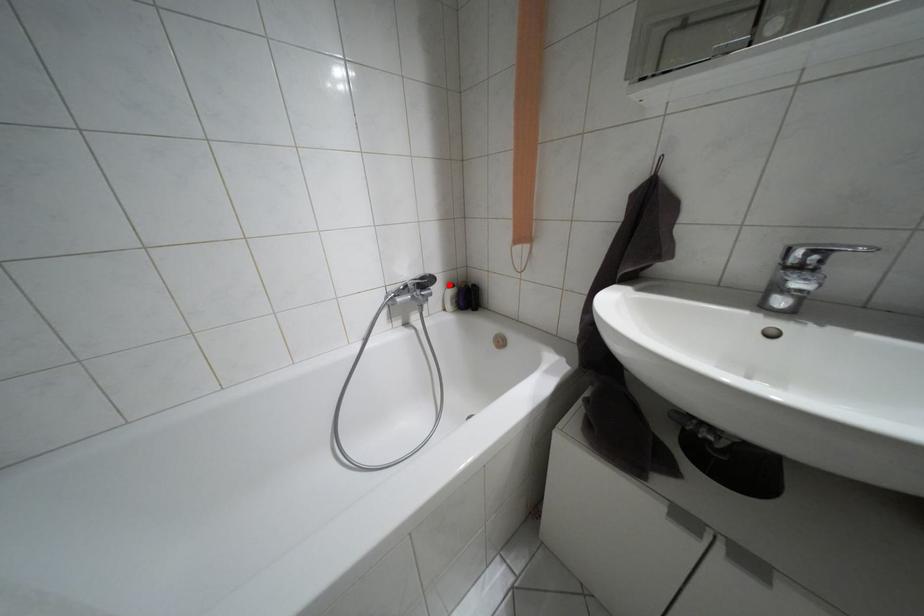
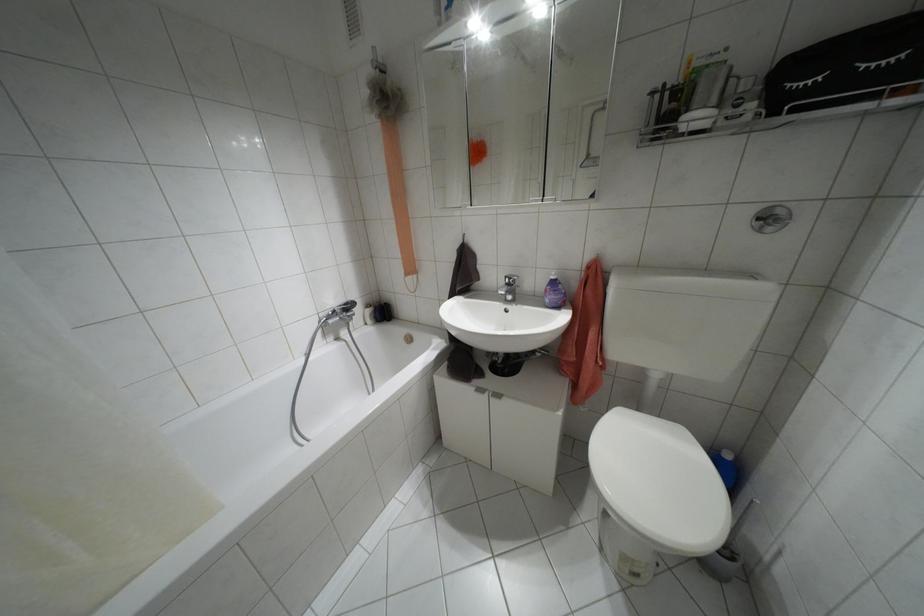
Find the pixel in the second image that matches the highlighted location in the first image.

(367, 305)